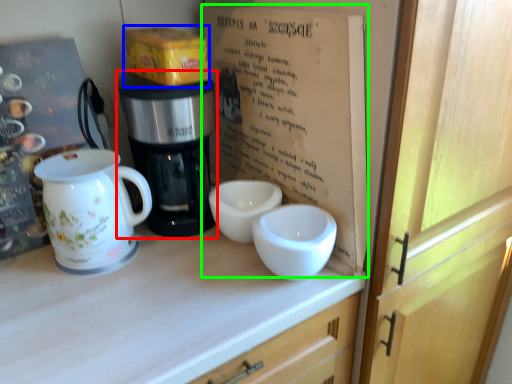
Question: Considering the real-world distances, which object is farthest from coffee maker (highlighted by a red box)? cardboard box (highlighted by a blue box) or book (highlighted by a green box)?

Choices:
 (A) cardboard box
 (B) book

Answer: (B)